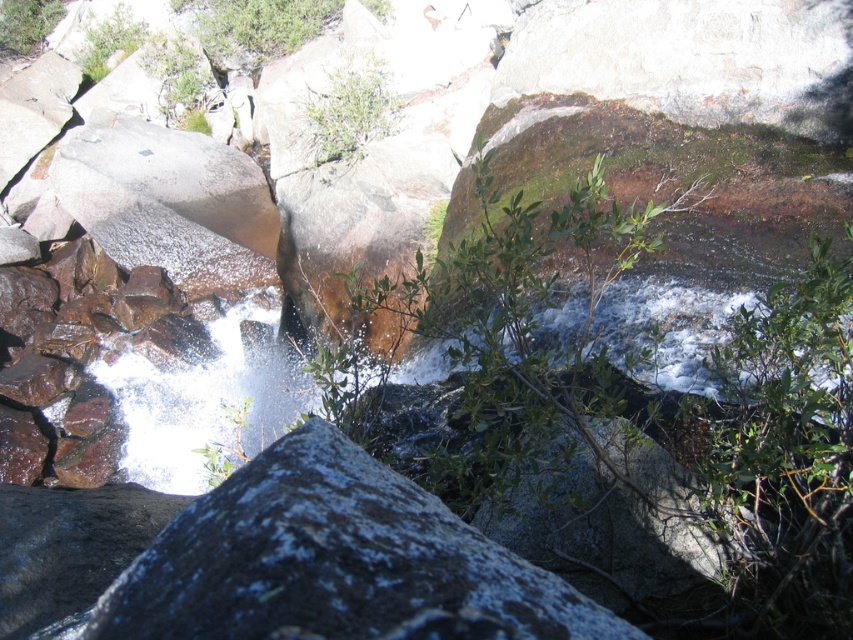
Consider the image. Can you confirm if gray/rough rock at center is taller than green leafy bush at center?

In fact, gray/rough rock at center may be shorter than green leafy bush at center.

Who is taller, gray/rough rock at center or green leafy bush at center?

Standing taller between the two is green leafy bush at center.

The image size is (853, 640). I want to click on gray/rough rock at center, so click(x=335, y=563).

Does green leafy bush at center come in front of green leafy bush at upper left?

Yes, it is in front of green leafy bush at upper left.

Describe the element at coordinates (347, 108) in the screenshot. The image size is (853, 640). I see `green leafy bush at center` at that location.

This screenshot has height=640, width=853. Find the location of `green leafy bush at center`. green leafy bush at center is located at coordinates (347, 108).

Does gray/rough rock at center appear over green leafy bush at upper left?

No.

What do you see at coordinates (335, 563) in the screenshot? The height and width of the screenshot is (640, 853). I see `gray/rough rock at center` at bounding box center [335, 563].

The height and width of the screenshot is (640, 853). What are the coordinates of `gray/rough rock at center` in the screenshot? It's located at (335, 563).